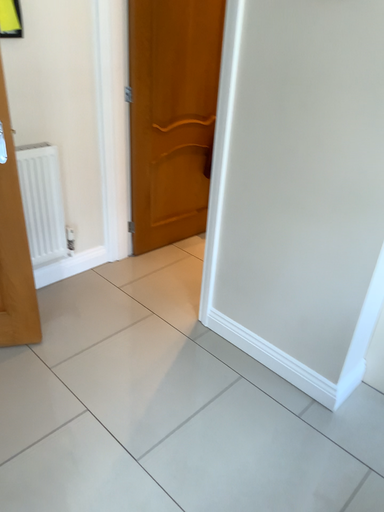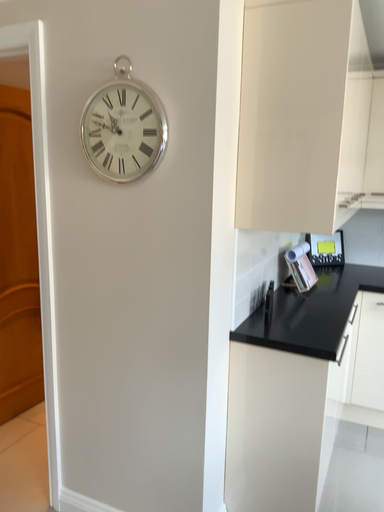
Question: How did the camera likely rotate when shooting the video?

Choices:
 (A) rotated right
 (B) rotated left

Answer: (A)